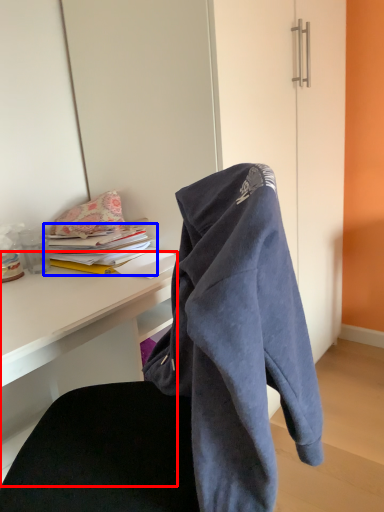
Question: Which point is closer to the camera, desk (highlighted by a red box) or book (highlighted by a blue box)?

Choices:
 (A) desk
 (B) book

Answer: (A)